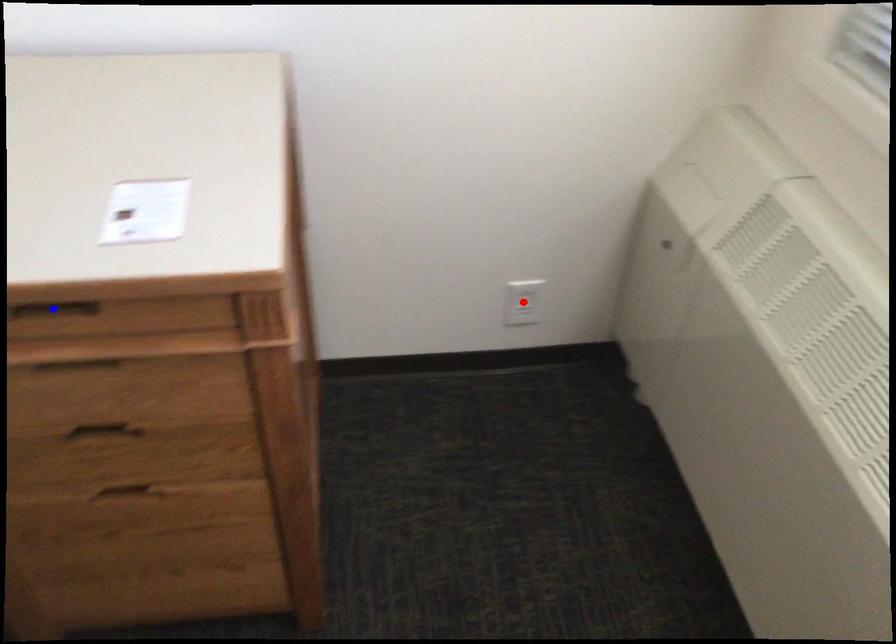
Question: Which of the two points in the image is closer to the camera?

Choices:
 (A) Blue point is closer.
 (B) Red point is closer.

Answer: (A)